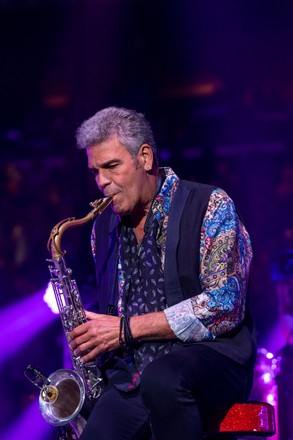
This screenshot has width=293, height=440. What are the coordinates of `seat` in the screenshot? It's located at (x=242, y=422).